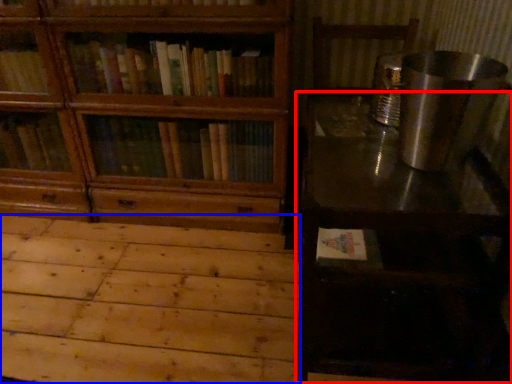
Question: Which point is further to the camera, table (highlighted by a red box) or plywood (highlighted by a blue box)?

Choices:
 (A) table
 (B) plywood

Answer: (B)